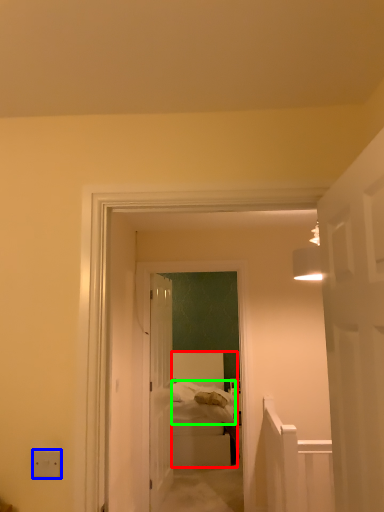
Question: Based on their relative distances, which object is farther from bed (highlighted by a red box)? Choose from electric outlet (highlighted by a blue box) and bedding (highlighted by a green box).

Choices:
 (A) electric outlet
 (B) bedding

Answer: (A)